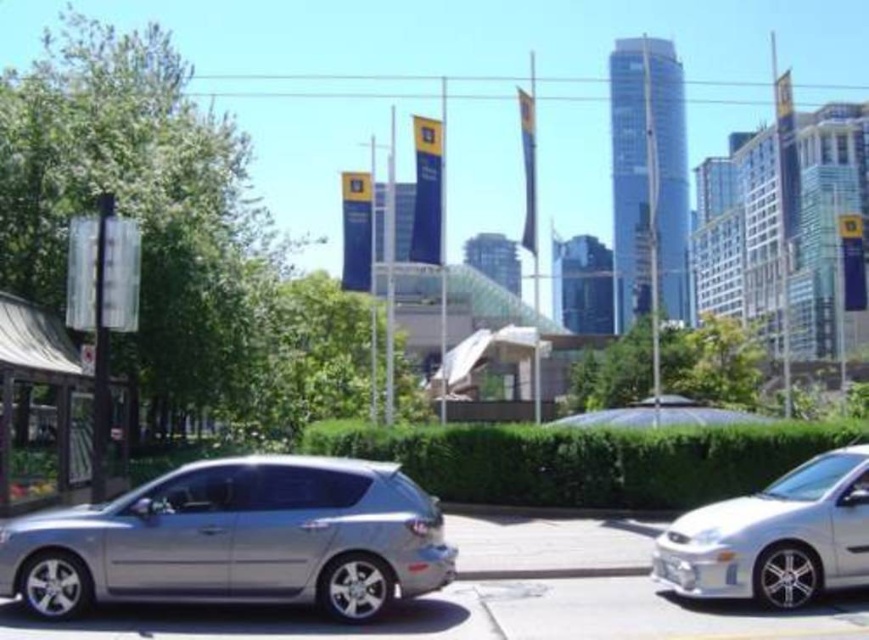
Question: Considering the relative positions of satin silver hatchback at center and satin white sedan at right in the image provided, where is satin silver hatchback at center located with respect to satin white sedan at right?

Choices:
 (A) right
 (B) left

Answer: (B)

Question: Among these points, which one is nearest to the camera?

Choices:
 (A) (438, 524)
 (B) (817, 454)

Answer: (A)

Question: Based on their relative distances, which object is nearer to the satin silver hatchback at center?

Choices:
 (A) green leafy hedge at center
 (B) satin white sedan at right

Answer: (B)

Question: Can you confirm if satin silver hatchback at center is wider than green leafy hedge at center?

Choices:
 (A) yes
 (B) no

Answer: (B)

Question: Can you confirm if satin silver hatchback at center is positioned below green leafy hedge at center?

Choices:
 (A) yes
 (B) no

Answer: (B)

Question: Which object is farther from the camera taking this photo?

Choices:
 (A) satin white sedan at right
 (B) green leafy hedge at center
 (C) satin silver hatchback at center

Answer: (B)